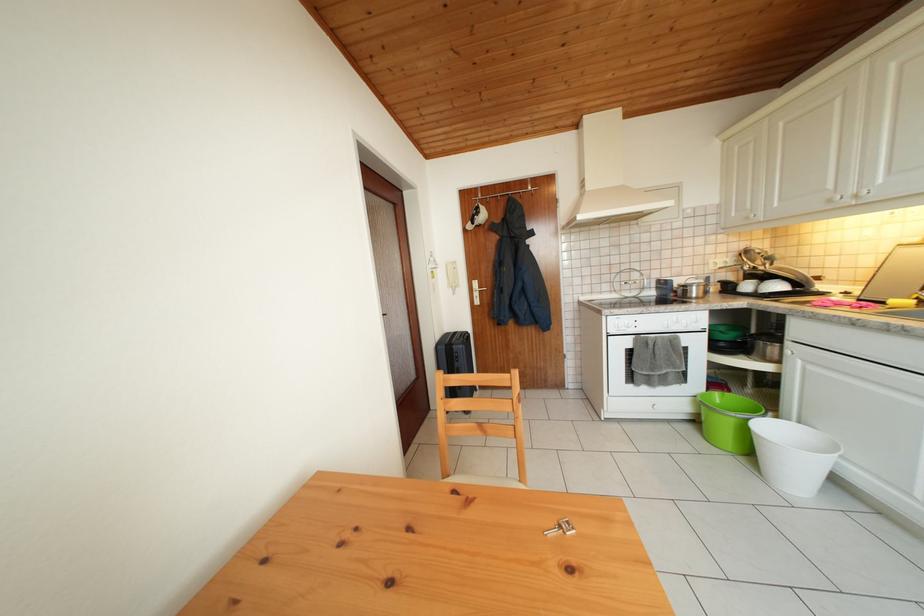
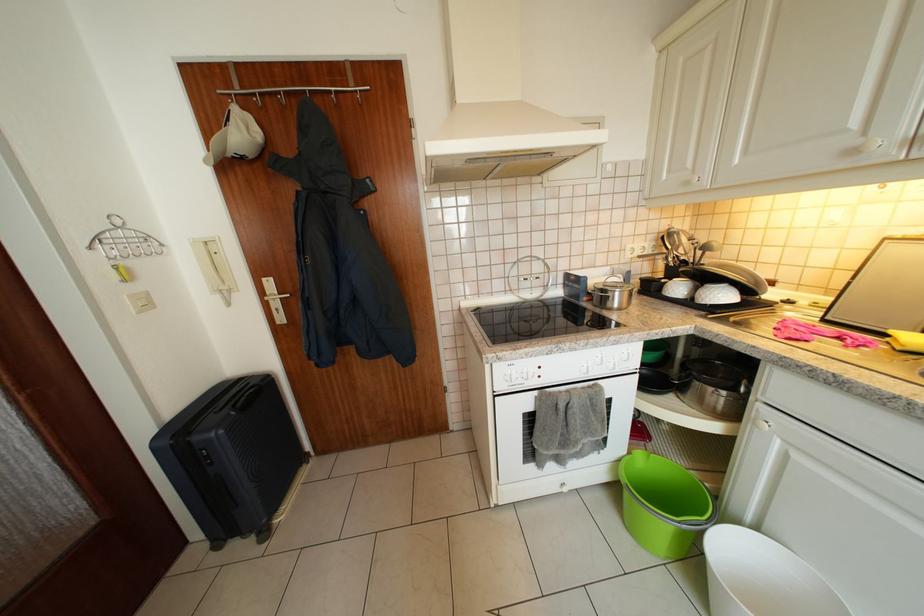
Where in the second image is the point corresponding to [785,293] from the first image?

(730, 300)